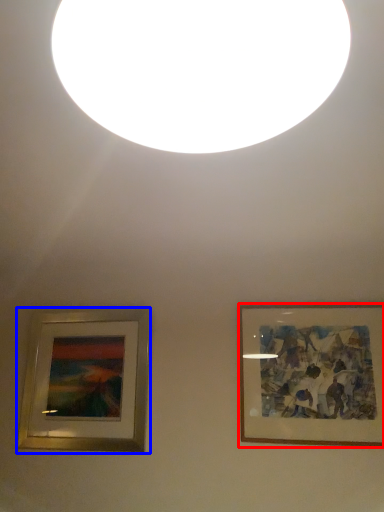
Question: Which object is closer to the camera taking this photo, picture frame (highlighted by a red box) or picture frame (highlighted by a blue box)?

Choices:
 (A) picture frame
 (B) picture frame

Answer: (A)